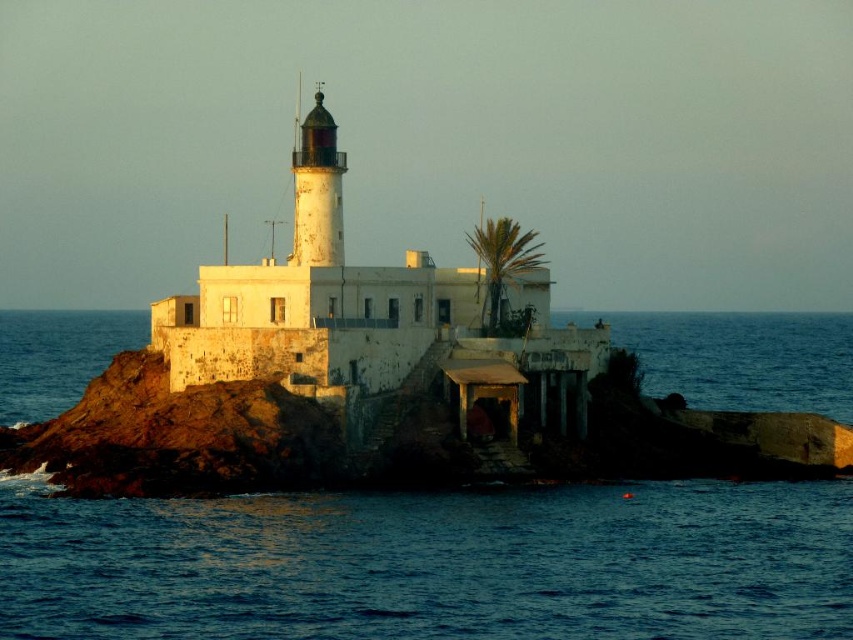
You are a bird flying over the lighthouse and want to land on the tallest object between the polished brass lighthouse at center and the green leafy palm at upper center. Which one should you choose?

The green leafy palm at upper center is taller than the polished brass lighthouse at center, so you should land on the green leafy palm at upper center.

You are standing at the base of the lighthouse and want to reach a point closer to you. Which of the two points, point (90,502) or point (508,241), should you head towards?

You should head towards point (90,502) because it is closer to the viewer than point (508,241).

Based on the photo, you are a lighthouse keeper who needs to reach the polished brass lighthouse at center to perform maintenance. The lighthouse is located at point (317, 189). You are currently standing at the bottom of the staircase leading down towards the water. Can you safely walk up the staircase to reach the polished brass lighthouse at center?

The polished brass lighthouse at center is located at point (317, 189). Since the staircase leads up from the water towards the lighthouse, you can safely walk up the staircase to reach it.